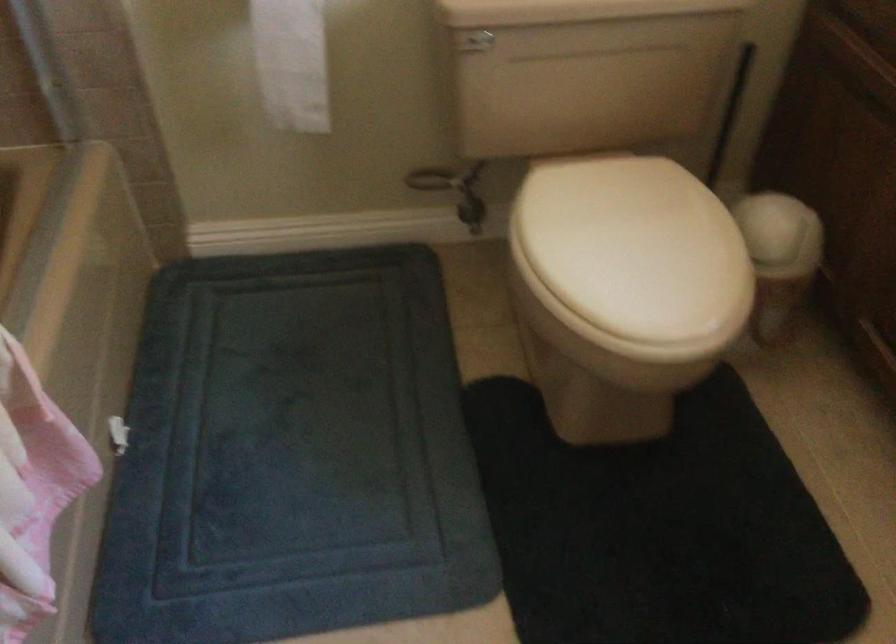
Identify the location of toilet flush handle. [475, 41].